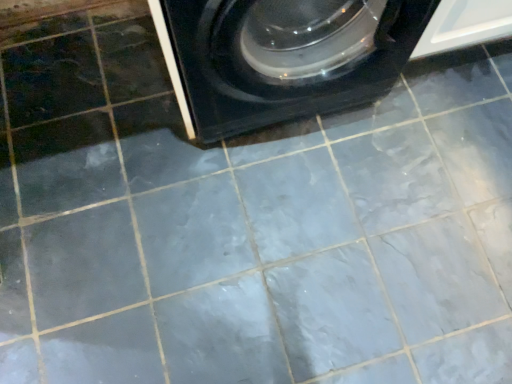
Where is `black glossy washing machine at upper center`? The height and width of the screenshot is (384, 512). black glossy washing machine at upper center is located at coordinates (281, 57).

What do you see at coordinates (281, 57) in the screenshot? The height and width of the screenshot is (384, 512). I see `black glossy washing machine at upper center` at bounding box center [281, 57].

Where is `black glossy washing machine at upper center`? The width and height of the screenshot is (512, 384). black glossy washing machine at upper center is located at coordinates (281, 57).